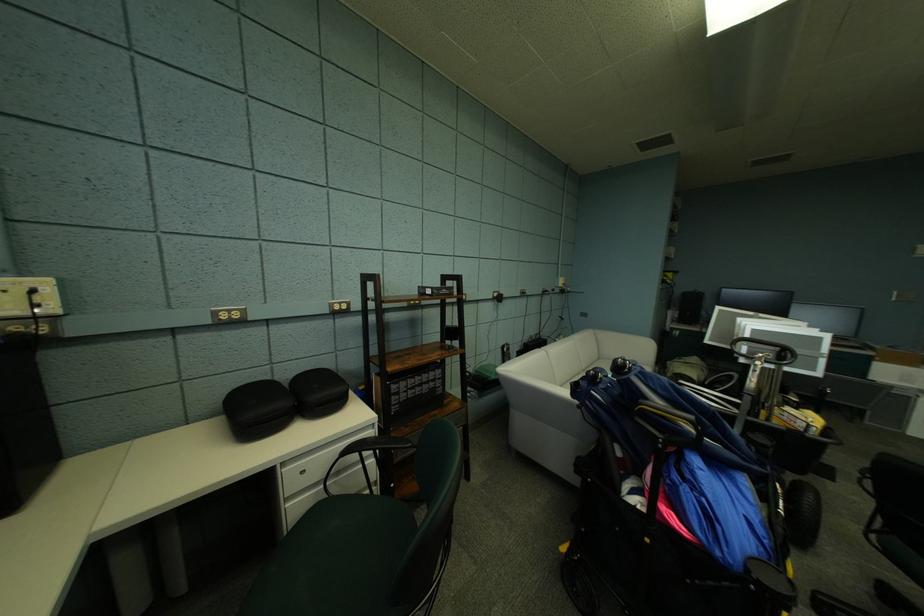
Find where to sit the green chair sitting surface. Please return your answer as a coordinate pair (x, y).

(346, 535)